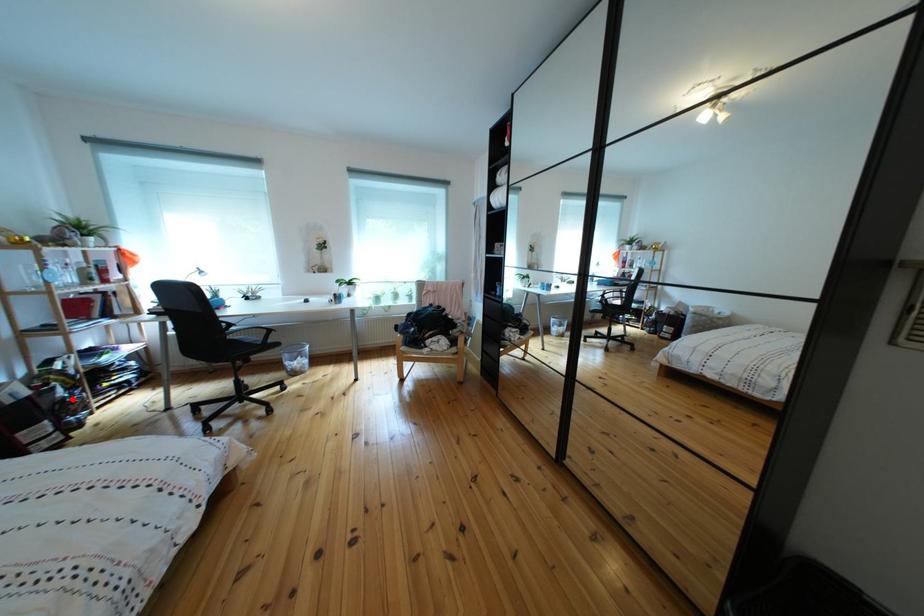
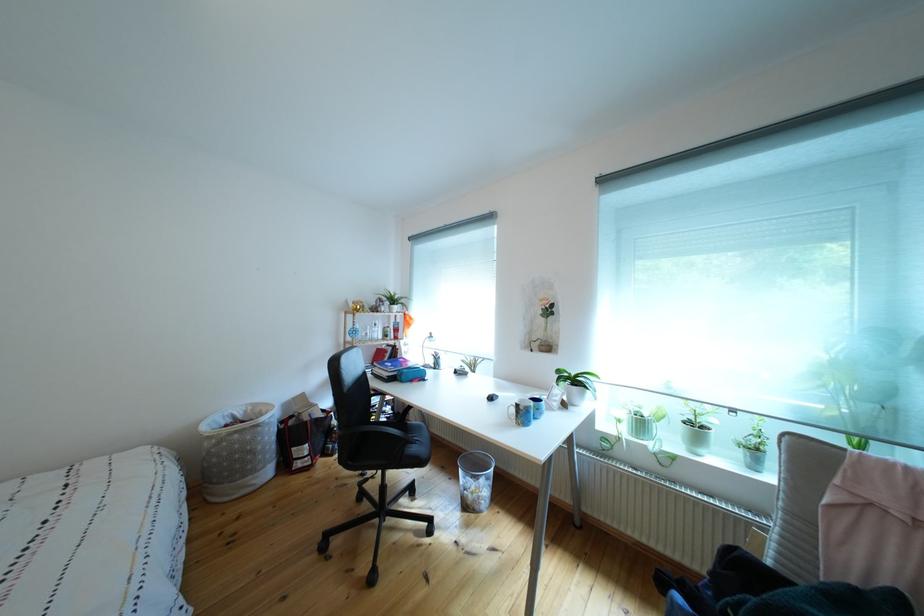
Question: A red point is marked in image1. In image2, is the corresponding 3D point closer to the camera or farther? Reply with the corresponding letter.

Choices:
 (A) The corresponding 3D point is closer.
 (B) The corresponding 3D point is farther.

Answer: (B)